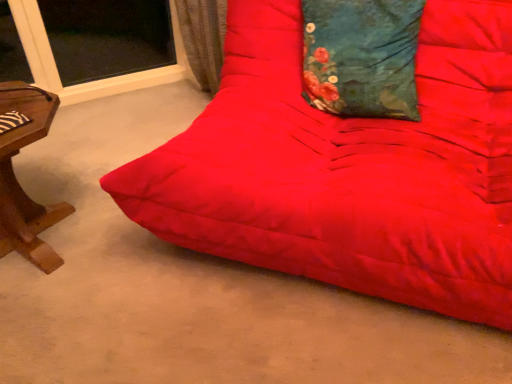
The image size is (512, 384). What do you see at coordinates (349, 168) in the screenshot?
I see `matte red futon at center` at bounding box center [349, 168].

The width and height of the screenshot is (512, 384). What are the coordinates of `matte red futon at center` in the screenshot? It's located at (349, 168).

What is the approximate height of matte red futon at center?

matte red futon at center is 33.60 inches tall.

I want to click on teal floral fabric pillow at upper center, so click(361, 57).

What do you see at coordinates (361, 57) in the screenshot? The height and width of the screenshot is (384, 512). I see `teal floral fabric pillow at upper center` at bounding box center [361, 57].

Where is `matte red futon at center`? This screenshot has width=512, height=384. matte red futon at center is located at coordinates (349, 168).

Would you say teal floral fabric pillow at upper center is to the left or to the right of matte red futon at center in the picture?

Clearly, teal floral fabric pillow at upper center is on the right of matte red futon at center in the image.

Which object is closer to the camera, teal floral fabric pillow at upper center or matte red futon at center?

matte red futon at center is in front.

Which point is more forward, (395,34) or (234,61)?

Point (395,34)

From the image's perspective, which one is positioned lower, teal floral fabric pillow at upper center or matte red futon at center?

From the image's view, matte red futon at center is below.

From a real-world perspective, is teal floral fabric pillow at upper center located higher than matte red futon at center?

Yes, from a real-world perspective, teal floral fabric pillow at upper center is on top of matte red futon at center.

Considering the sizes of teal floral fabric pillow at upper center and matte red futon at center in the image, is teal floral fabric pillow at upper center wider or thinner than matte red futon at center?

In the image, teal floral fabric pillow at upper center appears to be more narrow than matte red futon at center.

Is teal floral fabric pillow at upper center taller than matte red futon at center?

No, teal floral fabric pillow at upper center is not taller than matte red futon at center.

Who is smaller, teal floral fabric pillow at upper center or matte red futon at center?

Smaller between the two is teal floral fabric pillow at upper center.

From the picture: Is teal floral fabric pillow at upper center completely or partially outside of matte red futon at center?

Actually, teal floral fabric pillow at upper center is within matte red futon at center.

Would you consider teal floral fabric pillow at upper center to be distant from matte red futon at center?

They are positioned close to each other.

Could you tell me if teal floral fabric pillow at upper center is turned towards matte red futon at center?

Yes.

How much distance is there between teal floral fabric pillow at upper center and matte red futon at center?

They are 24.68 centimeters apart.

Find the location of a particular element. The image size is (512, 384). studio couch lying in front of the teal floral fabric pillow at upper center is located at coordinates (349, 168).

Considering the relative positions of matte red futon at center and teal floral fabric pillow at upper center in the image provided, is matte red futon at center to the left of teal floral fabric pillow at upper center from the viewer's perspective?

Yes, matte red futon at center is to the left of teal floral fabric pillow at upper center.

In the image, is matte red futon at center positioned in front of or behind teal floral fabric pillow at upper center?

Clearly, matte red futon at center is in front of teal floral fabric pillow at upper center.

Is point (433, 227) less distant than point (328, 27)?

Yes, it is in front of point (328, 27).

From the image's perspective, which one is positioned lower, matte red futon at center or teal floral fabric pillow at upper center?

matte red futon at center appears lower in the image.

From a real-world perspective, is matte red futon at center on top of teal floral fabric pillow at upper center?

No, from a real-world perspective, matte red futon at center is not above teal floral fabric pillow at upper center.

In the scene shown: Which of these two, matte red futon at center or teal floral fabric pillow at upper center, is wider?

Wider between the two is matte red futon at center.

Is matte red futon at center shorter than teal floral fabric pillow at upper center?

Incorrect, the height of matte red futon at center does not fall short of that of teal floral fabric pillow at upper center.

Looking at the image, does matte red futon at center seem bigger or smaller compared to teal floral fabric pillow at upper center?

matte red futon at center is bigger than teal floral fabric pillow at upper center.

Is matte red futon at center outside of teal floral fabric pillow at upper center?

Yes, matte red futon at center is located beyond the bounds of teal floral fabric pillow at upper center.

Is the surface of matte red futon at center in direct contact with teal floral fabric pillow at upper center?

No, matte red futon at center is not in contact with teal floral fabric pillow at upper center.

From the picture: Is matte red futon at center positioned with its back to teal floral fabric pillow at upper center?

That's right, matte red futon at center is facing away from teal floral fabric pillow at upper center.

Where is `studio couch below the teal floral fabric pillow at upper center (from a real-world perspective)`? The height and width of the screenshot is (384, 512). studio couch below the teal floral fabric pillow at upper center (from a real-world perspective) is located at coordinates (349, 168).

Identify the location of pillow located above the matte red futon at center (from the image's perspective). The image size is (512, 384). (361, 57).

Locate an element on the screen. studio couch below the teal floral fabric pillow at upper center (from a real-world perspective) is located at coordinates (349, 168).